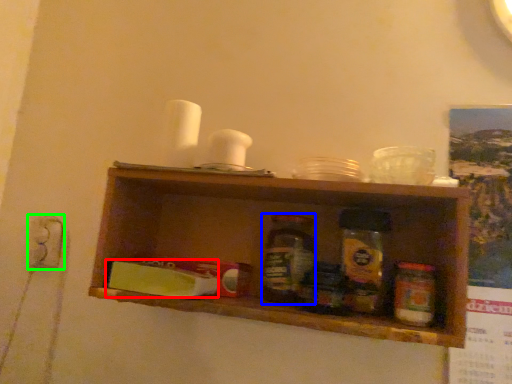
Question: Which is farther away from food (highlighted by a red box)? bottle (highlighted by a blue box) or electric outlet (highlighted by a green box)?

Choices:
 (A) bottle
 (B) electric outlet

Answer: (B)